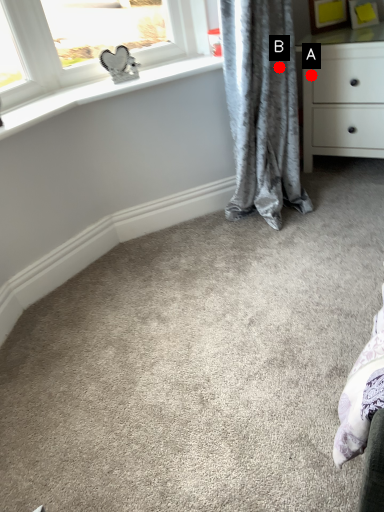
Question: Two points are circled on the image, labeled by A and B beside each circle. Which point appears farthest from the camera in this image?

Choices:
 (A) A is further
 (B) B is further

Answer: (A)